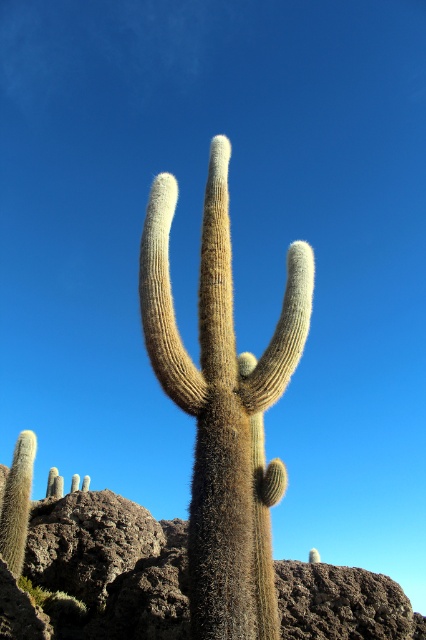
From the picture: Is brown rough rock at center smaller than green fuzzy cactus at lower left?

Actually, brown rough rock at center might be larger than green fuzzy cactus at lower left.

Between point (146, 534) and point (20, 547), which one is positioned in front?

Point (20, 547) is in front.

Does point (184, 593) lie behind point (14, 464)?

No, it is in front of (14, 464).

In order to click on brown rough rock at center in this screenshot , I will do `click(112, 564)`.

Between fuzzy brown cactus at center and green fuzzy cactus at lower left, which one is positioned higher?

fuzzy brown cactus at center

Between point (189, 525) and point (31, 429), which one is positioned in front?

Point (189, 525)

This screenshot has width=426, height=640. Identify the location of fuzzy brown cactus at center. (218, 394).

Locate an element on the screen. The height and width of the screenshot is (640, 426). fuzzy brown cactus at center is located at coordinates (218, 394).

Is fuzzy brown cactus at center below brown rough rock at center?

Actually, fuzzy brown cactus at center is above brown rough rock at center.

Who is positioned more to the left, fuzzy brown cactus at center or brown rough rock at center?

brown rough rock at center

Is point (267, 362) positioned before point (74, 515)?

Yes, point (267, 362) is in front of point (74, 515).

You are a GUI agent. You are given a task and a screenshot of the screen. Output one action in this format:
    pyautogui.click(x=<x>, y=<y>)
    Task: Click on the fuzzy brown cactus at center
    The image size is (426, 640).
    Given the screenshot: What is the action you would take?
    pyautogui.click(x=218, y=394)